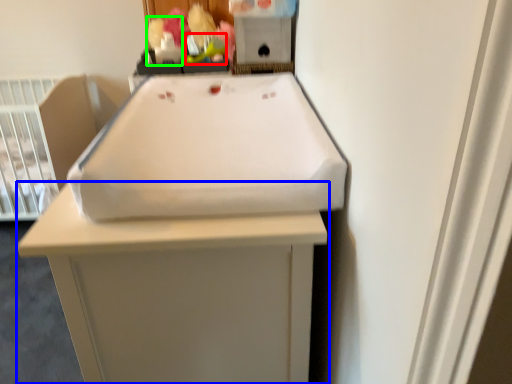
Question: Based on their relative distances, which object is farther from toy (highlighted by a red box)? Choose from furniture (highlighted by a blue box) and toy (highlighted by a green box).

Choices:
 (A) furniture
 (B) toy

Answer: (A)